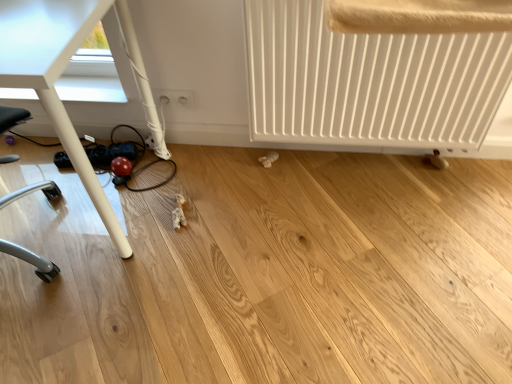
Where is `free space on the front side of white matte radiator at lower right`? The height and width of the screenshot is (384, 512). free space on the front side of white matte radiator at lower right is located at coordinates (378, 254).